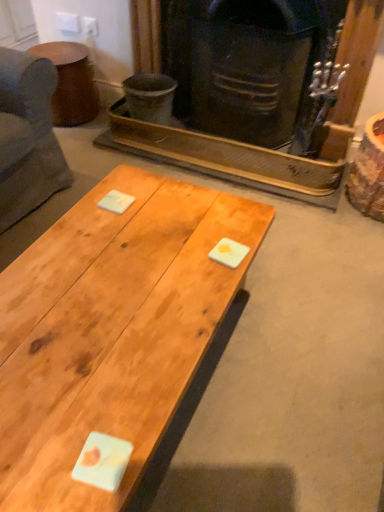
Where is `vacant space situated above natural wood coffee table at center (from a real-world perspective)`? vacant space situated above natural wood coffee table at center (from a real-world perspective) is located at coordinates (120, 287).